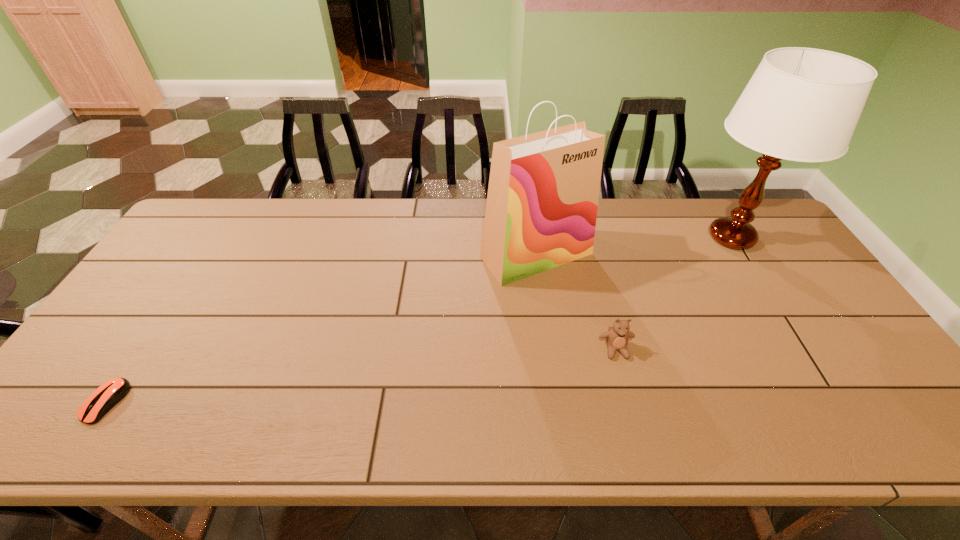
Find the location of a particular element. This screenshot has width=960, height=540. table lamp that is at the far edge is located at coordinates (802, 104).

At what (x,y) coordinates should I click in order to perform the action: click on shopping bag located at the far edge. Please return your answer as a coordinate pair (x, y). Image resolution: width=960 pixels, height=540 pixels. Looking at the image, I should click on point(542,201).

You are a GUI agent. You are given a task and a screenshot of the screen. Output one action in this format:
    pyautogui.click(x=<x>, y=<y>)
    Task: Click on the object located at the near edge
    The height and width of the screenshot is (540, 960).
    Given the screenshot: What is the action you would take?
    (x=104, y=398)

Where is `object positioned at the left edge`? The image size is (960, 540). object positioned at the left edge is located at coordinates (104, 398).

What are the coordinates of `object that is at the right edge` in the screenshot? It's located at (802, 104).

Where is `object that is at the near left corner`? Image resolution: width=960 pixels, height=540 pixels. object that is at the near left corner is located at coordinates (104, 398).

You are a GUI agent. You are given a task and a screenshot of the screen. Output one action in this format:
    pyautogui.click(x=<x>, y=<y>)
    Task: Click on the object that is at the far right corner
    
    Given the screenshot: What is the action you would take?
    pyautogui.click(x=802, y=104)

In the image, there is a desktop. Identify the location of free region at the far edge. (468, 242).

In order to click on vacant space at the near edge in this screenshot , I will do tap(121, 437).

Find the location of a particular element. The height and width of the screenshot is (540, 960). vacant space at the left edge is located at coordinates (167, 269).